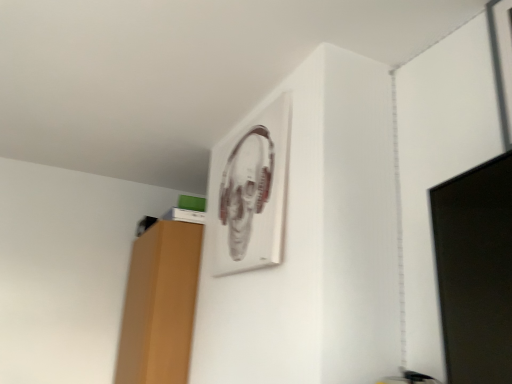
You are a GUI agent. You are given a task and a screenshot of the screen. Output one action in this format:
    pyautogui.click(x=<x>, y=<y>)
    Task: Click on the metallic silver picture frame at upper center
    This screenshot has width=512, height=384.
    Given the screenshot: What is the action you would take?
    coord(252,192)

This screenshot has width=512, height=384. What do you see at coordinates (252, 192) in the screenshot?
I see `metallic silver picture frame at upper center` at bounding box center [252, 192].

Where is `black glossy monitor at right`? The height and width of the screenshot is (384, 512). black glossy monitor at right is located at coordinates (475, 271).

The width and height of the screenshot is (512, 384). Describe the element at coordinates (475, 271) in the screenshot. I see `black glossy monitor at right` at that location.

Image resolution: width=512 pixels, height=384 pixels. I want to click on metallic silver picture frame at upper center, so (252, 192).

Considering the relative positions of metallic silver picture frame at upper center and black glossy monitor at right in the image provided, is metallic silver picture frame at upper center to the right of black glossy monitor at right from the viewer's perspective?

No, metallic silver picture frame at upper center is not to the right of black glossy monitor at right.

Is metallic silver picture frame at upper center behind black glossy monitor at right?

Yes, metallic silver picture frame at upper center is behind black glossy monitor at right.

Which point is more distant from viewer, [237,265] or [484,208]?

The point [237,265] is farther from the camera.

From the image's perspective, is metallic silver picture frame at upper center positioned above or below black glossy monitor at right?

Based on their image positions, metallic silver picture frame at upper center is located above black glossy monitor at right.

From a real-world perspective, between metallic silver picture frame at upper center and black glossy monitor at right, who is vertically higher?

In real-world perspective, metallic silver picture frame at upper center is above.

Which of these two, metallic silver picture frame at upper center or black glossy monitor at right, is thinner?

With smaller width is metallic silver picture frame at upper center.

Can you confirm if metallic silver picture frame at upper center is shorter than black glossy monitor at right?

Incorrect, the height of metallic silver picture frame at upper center does not fall short of that of black glossy monitor at right.

Between metallic silver picture frame at upper center and black glossy monitor at right, which one has smaller size?

With smaller size is metallic silver picture frame at upper center.

Can we say metallic silver picture frame at upper center lies outside black glossy monitor at right?

Indeed, metallic silver picture frame at upper center is completely outside black glossy monitor at right.

Is metallic silver picture frame at upper center not close to black glossy monitor at right?

No, metallic silver picture frame at upper center is not far from black glossy monitor at right.

Does metallic silver picture frame at upper center turn towards black glossy monitor at right?

No, metallic silver picture frame at upper center is not turned towards black glossy monitor at right.

How different are the orientations of metallic silver picture frame at upper center and black glossy monitor at right in degrees?

13.8 degrees.

This screenshot has width=512, height=384. In order to click on picture frame that is on the left side of black glossy monitor at right in this screenshot , I will do `click(252, 192)`.

Which is more to the left, black glossy monitor at right or metallic silver picture frame at upper center?

metallic silver picture frame at upper center.

Which object is closer to the camera taking this photo, black glossy monitor at right or metallic silver picture frame at upper center?

black glossy monitor at right is closer to the camera.

Is point (483, 322) more distant than point (279, 177)?

No, (483, 322) is closer to viewer.

From the image's perspective, is black glossy monitor at right on top of metallic silver picture frame at upper center?

Incorrect, from the image's perspective, black glossy monitor at right is lower than metallic silver picture frame at upper center.

From a real-world perspective, is black glossy monitor at right under metallic silver picture frame at upper center?

Yes.

Looking at their sizes, would you say black glossy monitor at right is wider or thinner than metallic silver picture frame at upper center?

Clearly, black glossy monitor at right has more width compared to metallic silver picture frame at upper center.

Does black glossy monitor at right have a greater height compared to metallic silver picture frame at upper center?

Incorrect, the height of black glossy monitor at right is not larger of that of metallic silver picture frame at upper center.

Is black glossy monitor at right bigger or smaller than metallic silver picture frame at upper center?

In the image, black glossy monitor at right appears to be larger than metallic silver picture frame at upper center.

Choose the correct answer: Is black glossy monitor at right inside metallic silver picture frame at upper center or outside it?

black glossy monitor at right exists outside the volume of metallic silver picture frame at upper center.

From the picture: Does black glossy monitor at right touch metallic silver picture frame at upper center?

There is a gap between black glossy monitor at right and metallic silver picture frame at upper center.

Is black glossy monitor at right oriented towards metallic silver picture frame at upper center?

No, black glossy monitor at right is not aimed at metallic silver picture frame at upper center.

How different are the orientations of black glossy monitor at right and metallic silver picture frame at upper center in degrees?

13.8 degrees.

How much distance is there between black glossy monitor at right and metallic silver picture frame at upper center?

black glossy monitor at right and metallic silver picture frame at upper center are 35.34 inches apart.

You are a GUI agent. You are given a task and a screenshot of the screen. Output one action in this format:
    pyautogui.click(x=<x>, y=<y>)
    Task: Click on the picture frame above the black glossy monitor at right (from a real-world perspective)
    This screenshot has height=384, width=512.
    Given the screenshot: What is the action you would take?
    pyautogui.click(x=252, y=192)

There is a black glossy monitor at right. Find the location of `picture frame above it (from a real-world perspective)`. picture frame above it (from a real-world perspective) is located at coordinates (252, 192).

Where is `picture frame on the left of black glossy monitor at right`? This screenshot has height=384, width=512. picture frame on the left of black glossy monitor at right is located at coordinates (252, 192).